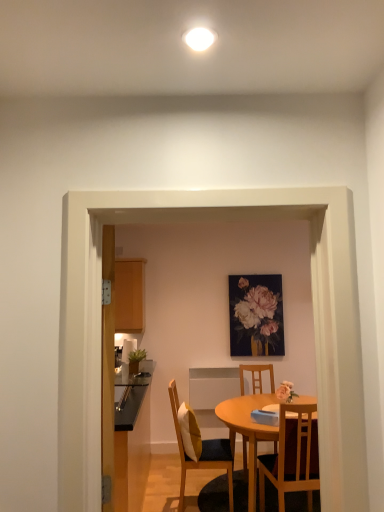
This screenshot has width=384, height=512. In order to click on vacant area on top of matte black picture frame at center (from a real-world perspective) in this screenshot , I will do `click(258, 270)`.